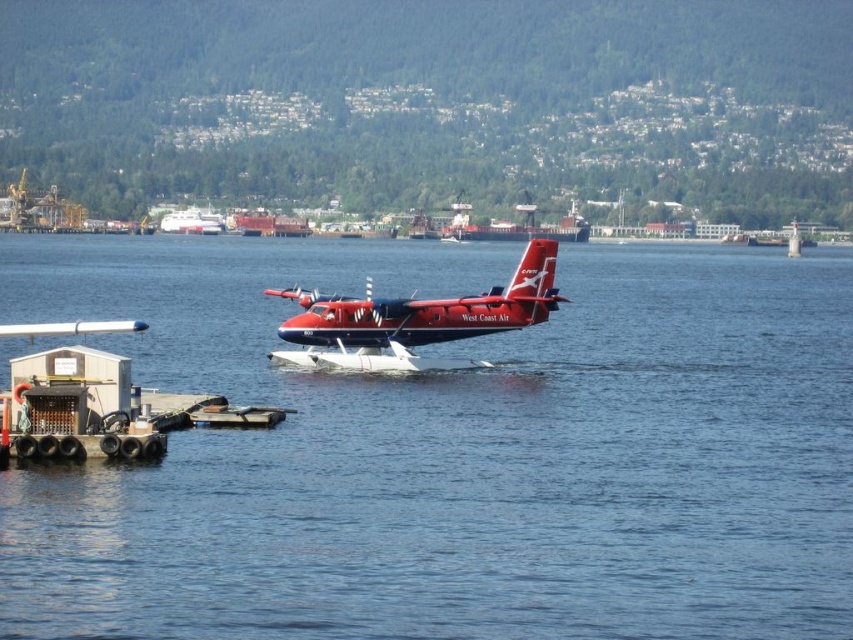
Question: Does blue water at center have a greater width compared to matte red seaplane at center?

Choices:
 (A) yes
 (B) no

Answer: (A)

Question: Is the position of matte red seaplane at center more distant than that of white plastic boat at center?

Choices:
 (A) yes
 (B) no

Answer: (B)

Question: Which of these objects is positioned farthest from the white plastic boat at center?

Choices:
 (A) matte red seaplane at center
 (B) blue water at center

Answer: (A)

Question: Among these objects, which one is nearest to the camera?

Choices:
 (A) white plastic boat at center
 (B) matte red seaplane at center
 (C) blue water at center

Answer: (C)

Question: Is blue water at center to the left of matte red seaplane at center from the viewer's perspective?

Choices:
 (A) no
 (B) yes

Answer: (A)

Question: Which object is farther from the camera taking this photo?

Choices:
 (A) white plastic boat at center
 (B) matte red seaplane at center
 (C) blue water at center

Answer: (A)